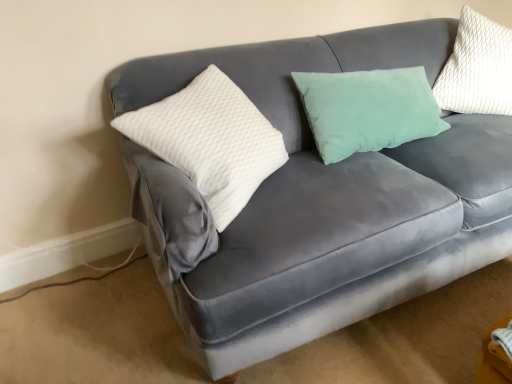
Question: Looking at their shapes, would you say white textured pillow at upper right, the 1th pillow in the right-to-left sequence, is wider or thinner than white textured pillow at left, the first pillow viewed from the left?

Choices:
 (A) thin
 (B) wide

Answer: (A)

Question: From a real-world perspective, is white textured pillow at upper right, placed as the second pillow when sorted from left to right, above or below white textured pillow at left, positioned as the 2th pillow in right-to-left order?

Choices:
 (A) below
 (B) above

Answer: (B)

Question: Choose the correct answer: Is white textured pillow at upper right, the 1th pillow in the right-to-left sequence, inside white textured pillow at left, positioned as the 2th pillow in right-to-left order, or outside it?

Choices:
 (A) inside
 (B) outside

Answer: (B)

Question: From the image's perspective, relative to white textured pillow at upper right, placed as the second pillow when sorted from left to right, is white textured pillow at left, the first pillow viewed from the left, above or below?

Choices:
 (A) below
 (B) above

Answer: (A)

Question: In terms of width, does white textured pillow at left, positioned as the 2th pillow in right-to-left order, look wider or thinner when compared to white textured pillow at upper right, placed as the second pillow when sorted from left to right?

Choices:
 (A) thin
 (B) wide

Answer: (B)

Question: Considering the positions of white textured pillow at left, the first pillow viewed from the left, and white textured pillow at upper right, placed as the second pillow when sorted from left to right, in the image, is white textured pillow at left, the first pillow viewed from the left, taller or shorter than white textured pillow at upper right, placed as the second pillow when sorted from left to right,?

Choices:
 (A) tall
 (B) short

Answer: (B)

Question: Is point (124, 119) closer or farther from the camera than point (484, 24)?

Choices:
 (A) farther
 (B) closer

Answer: (B)